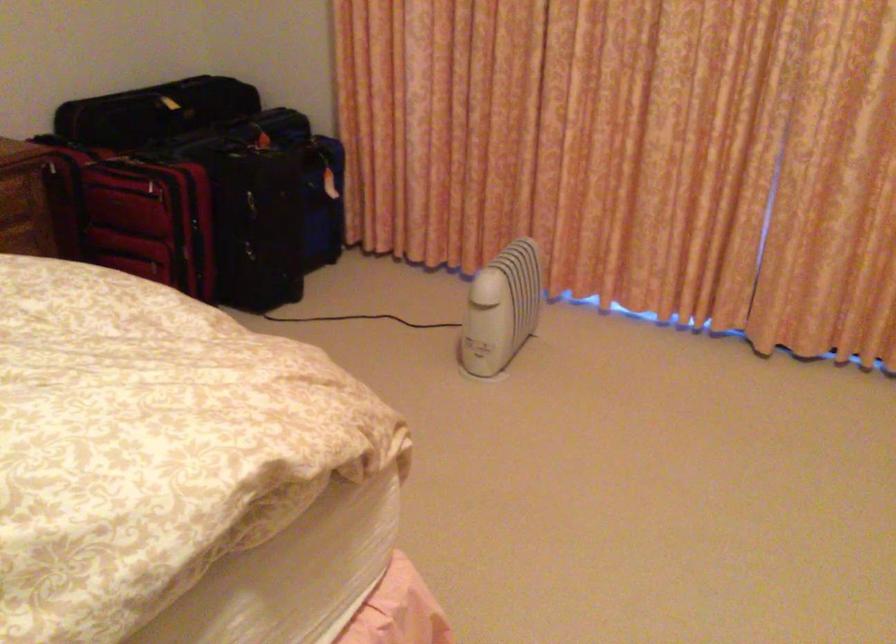
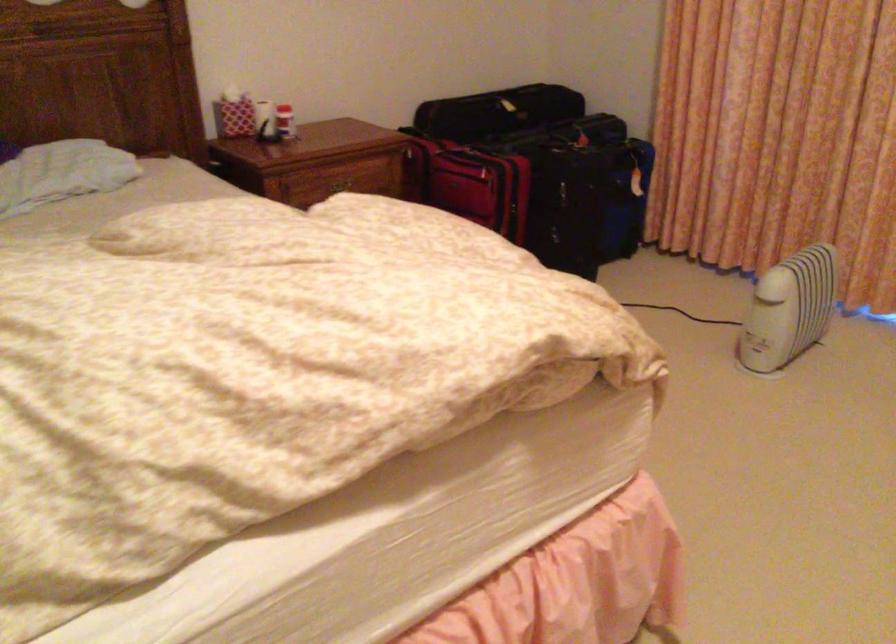
Find the pixel in the second image that matches (x=504, y=324) in the first image.

(789, 308)